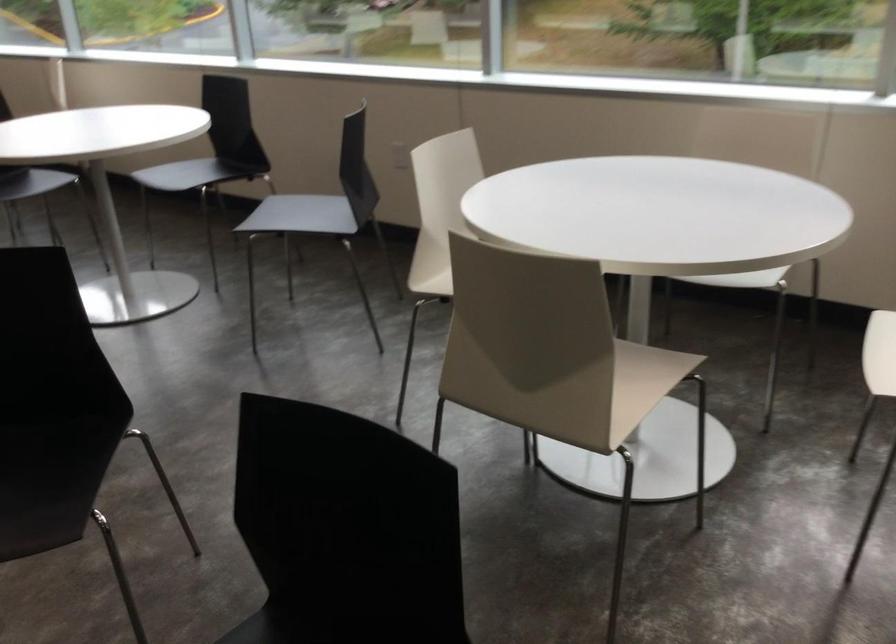
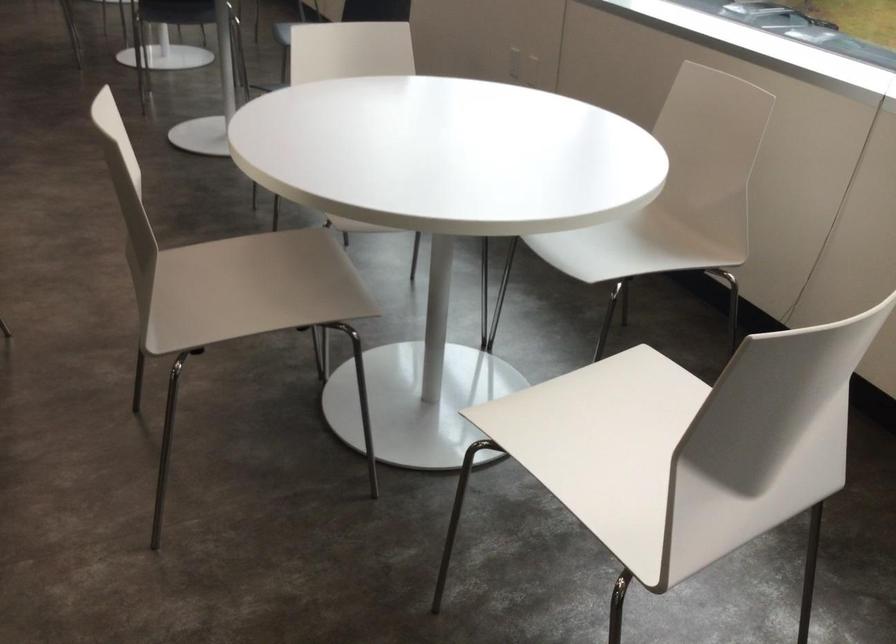
Locate, in the second image, the point that corresponds to the point at 564,380 in the first image.

(252, 288)